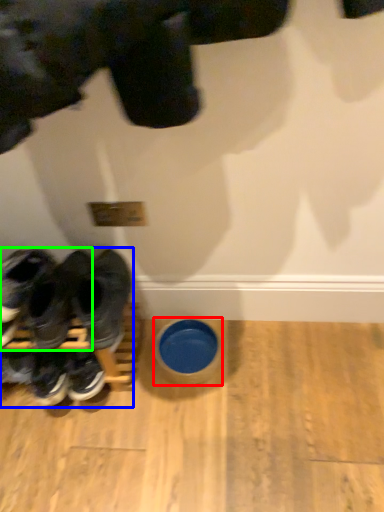
Question: Which object is the farthest from bowl (highlighted by a red box)? Choose among these: footwear (highlighted by a blue box) or footwear (highlighted by a green box).

Choices:
 (A) footwear
 (B) footwear

Answer: (B)